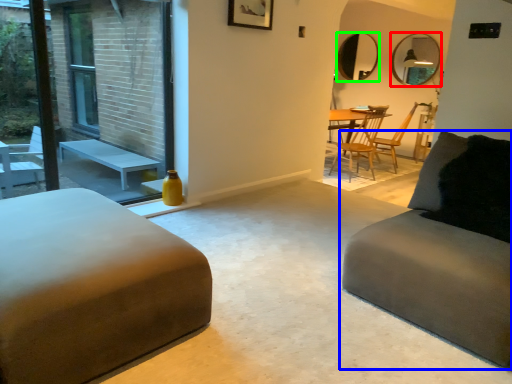
Question: Considering the real-world distances, which object is farthest from mirror (highlighted by a red box)? studio couch (highlighted by a blue box) or mirror (highlighted by a green box)?

Choices:
 (A) studio couch
 (B) mirror

Answer: (A)